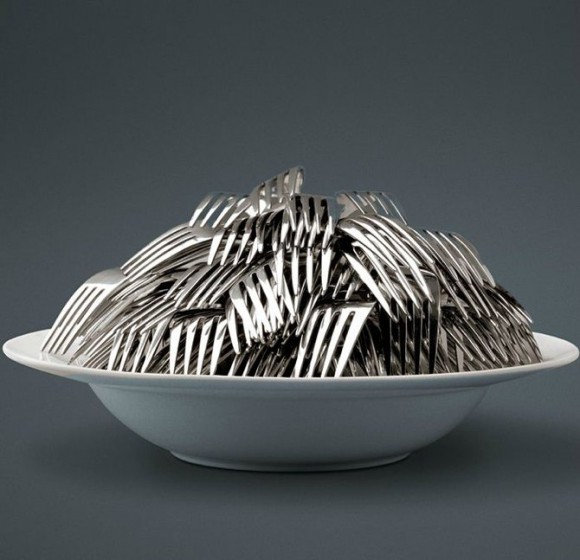
At what (x,y) coordinates should I click in order to perform the action: click on bowl. Please return your answer as a coordinate pair (x, y). Looking at the image, I should click on (325, 419).